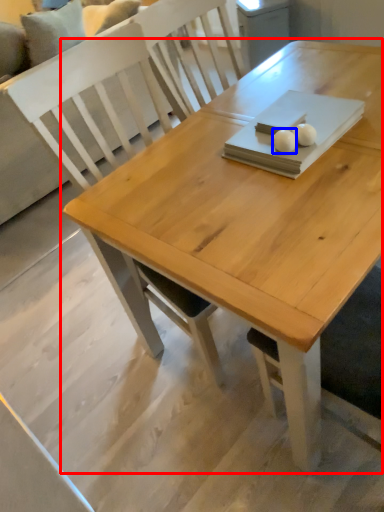
Question: Among these objects, which one is nearest to the camera, table (highlighted by a red box) or food (highlighted by a blue box)?

Choices:
 (A) table
 (B) food

Answer: (A)